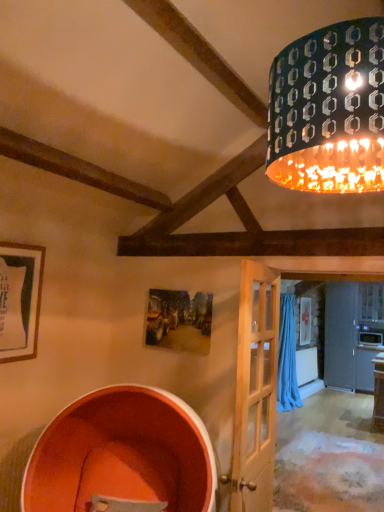
Question: Can orange matte barrel at lower left be found inside metallic patterned shade at upper right?

Choices:
 (A) no
 (B) yes

Answer: (A)

Question: Is metallic patterned shade at upper right located outside orange matte barrel at lower left?

Choices:
 (A) yes
 (B) no

Answer: (A)

Question: Is metallic patterned shade at upper right at the right side of orange matte barrel at lower left?

Choices:
 (A) no
 (B) yes

Answer: (B)

Question: Is metallic patterned shade at upper right next to orange matte barrel at lower left?

Choices:
 (A) yes
 (B) no

Answer: (B)

Question: Is metallic patterned shade at upper right to the left of orange matte barrel at lower left from the viewer's perspective?

Choices:
 (A) no
 (B) yes

Answer: (A)

Question: Is metallic patterned shade at upper right not close to orange matte barrel at lower left?

Choices:
 (A) no
 (B) yes

Answer: (B)

Question: From a real-world perspective, is metallic patterned shade at upper right on top of light wood door at center?

Choices:
 (A) yes
 (B) no

Answer: (A)

Question: Are metallic patterned shade at upper right and light wood door at center making contact?

Choices:
 (A) yes
 (B) no

Answer: (B)

Question: Considering the relative sizes of metallic patterned shade at upper right and light wood door at center in the image provided, is metallic patterned shade at upper right shorter than light wood door at center?

Choices:
 (A) yes
 (B) no

Answer: (A)

Question: Can you confirm if metallic patterned shade at upper right is positioned to the right of light wood door at center?

Choices:
 (A) yes
 (B) no

Answer: (A)

Question: Considering the relative positions of metallic patterned shade at upper right and light wood door at center in the image provided, is metallic patterned shade at upper right in front of light wood door at center?

Choices:
 (A) no
 (B) yes

Answer: (B)

Question: From the image's perspective, is metallic patterned shade at upper right located above light wood door at center?

Choices:
 (A) no
 (B) yes

Answer: (B)

Question: Is light wood door at center outside of orange matte barrel at lower left?

Choices:
 (A) no
 (B) yes

Answer: (B)